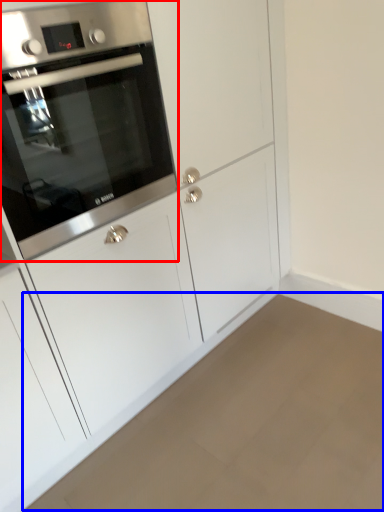
Question: Which object is further to the camera taking this photo, oven (highlighted by a red box) or plain (highlighted by a blue box)?

Choices:
 (A) oven
 (B) plain

Answer: (A)